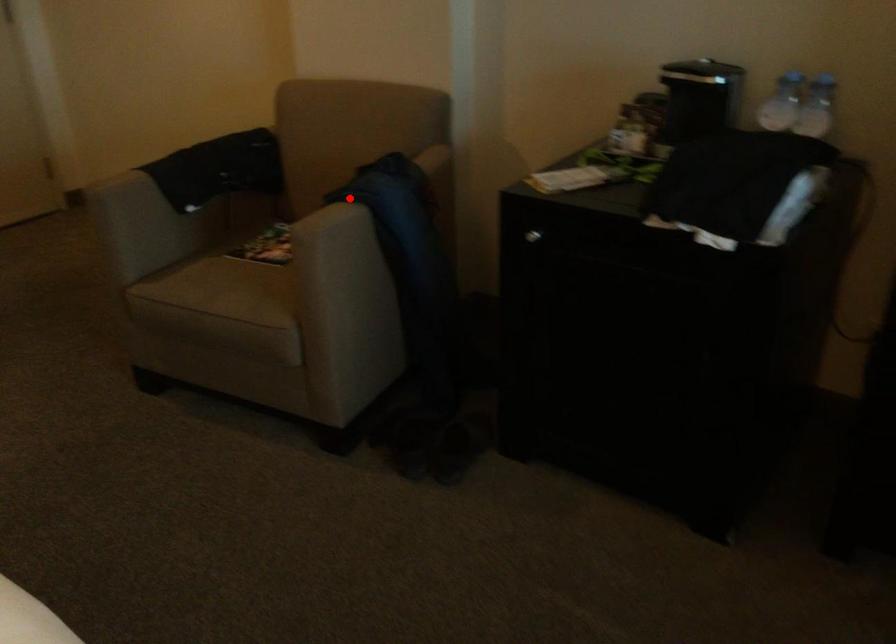
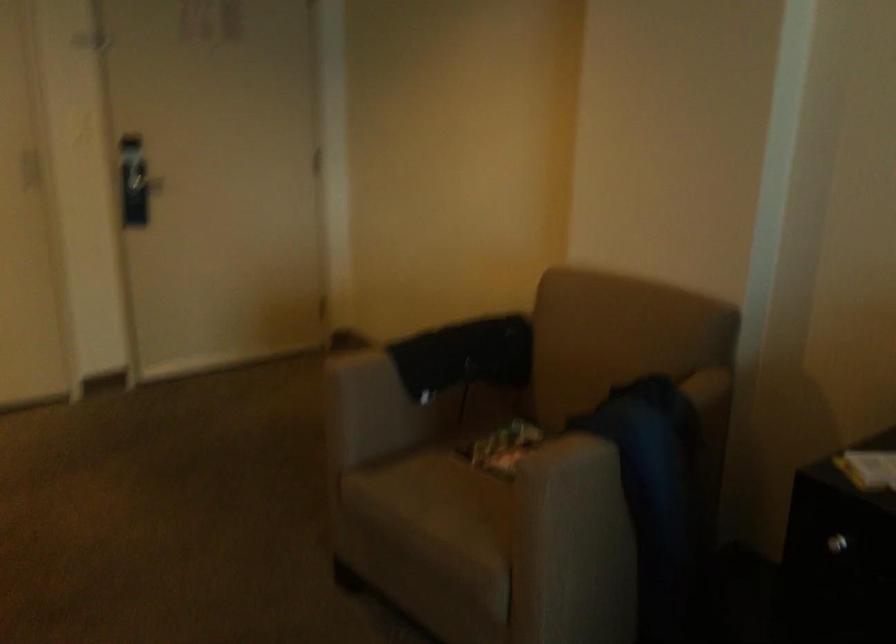
In the second image, find the point that corresponds to the highlighted location in the first image.

(597, 433)